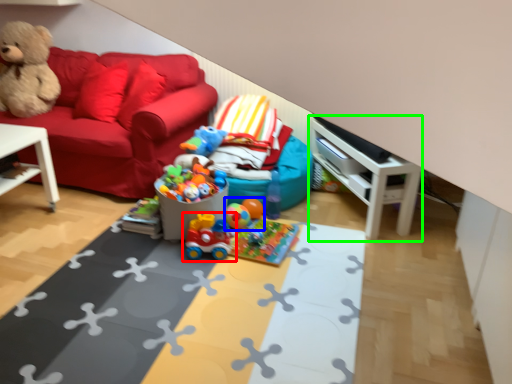
Question: Which object is the closest to the toy (highlighted by a red box)? Choose among these: toy (highlighted by a blue box) or entertainment center (highlighted by a green box).

Choices:
 (A) toy
 (B) entertainment center

Answer: (A)